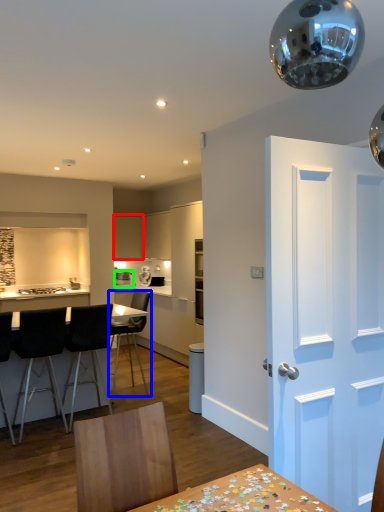
Question: Based on their relative distances, which object is nearer to cabinetry (highlighted by a red box)? Choose from chair (highlighted by a blue box) and appliance (highlighted by a green box).

Choices:
 (A) chair
 (B) appliance

Answer: (B)